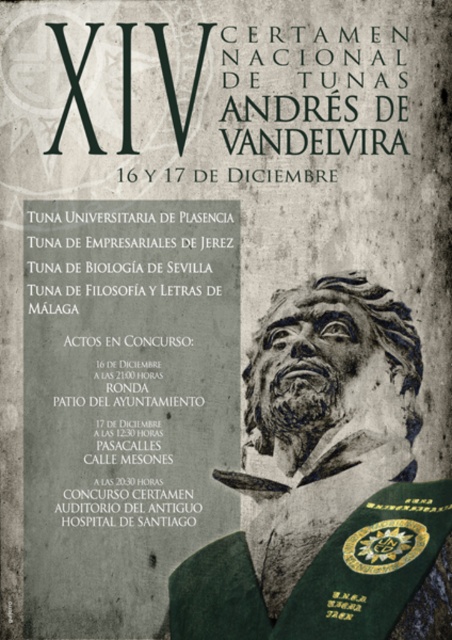
You are standing 30 meters away from the poster. Can you read the black paper text at upper left clearly?

The black paper text at upper left is 29.52 meters away from the camera, so you are standing slightly closer than that distance. Therefore, you should be able to read it clearly.

You are looking at the promotional poster for the XIV Certamen Nacional de Tunas Andr. de Vandelvira. You notice the black paper text at upper left and the bronze statue at center. Which object is positioned to the left of the other?

The black paper text at upper left is to the left of bronze statue at center.